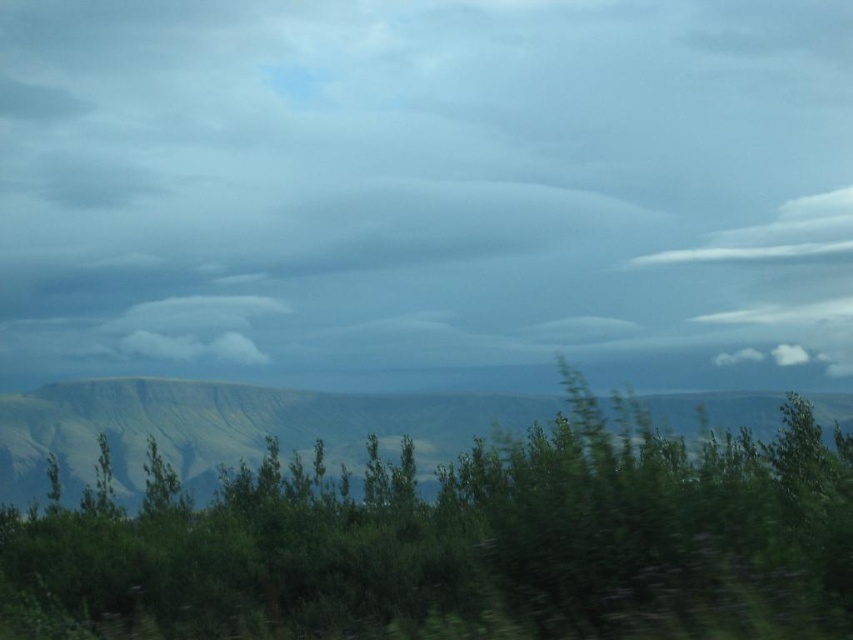
Question: Is gray/cloudy sky at center further to the viewer compared to green leafy shrub at center?

Choices:
 (A) no
 (B) yes

Answer: (B)

Question: Among these objects, which one is nearest to the camera?

Choices:
 (A) green leafy shrub at center
 (B) gray/cloudy sky at center

Answer: (A)

Question: Is gray/cloudy sky at center smaller than green leafy shrub at center?

Choices:
 (A) no
 (B) yes

Answer: (B)

Question: Is gray/cloudy sky at center closer to the viewer compared to green leafy shrub at center?

Choices:
 (A) no
 (B) yes

Answer: (A)

Question: Which point is closer to the camera?

Choices:
 (A) gray/cloudy sky at center
 (B) green leafy shrub at center

Answer: (B)